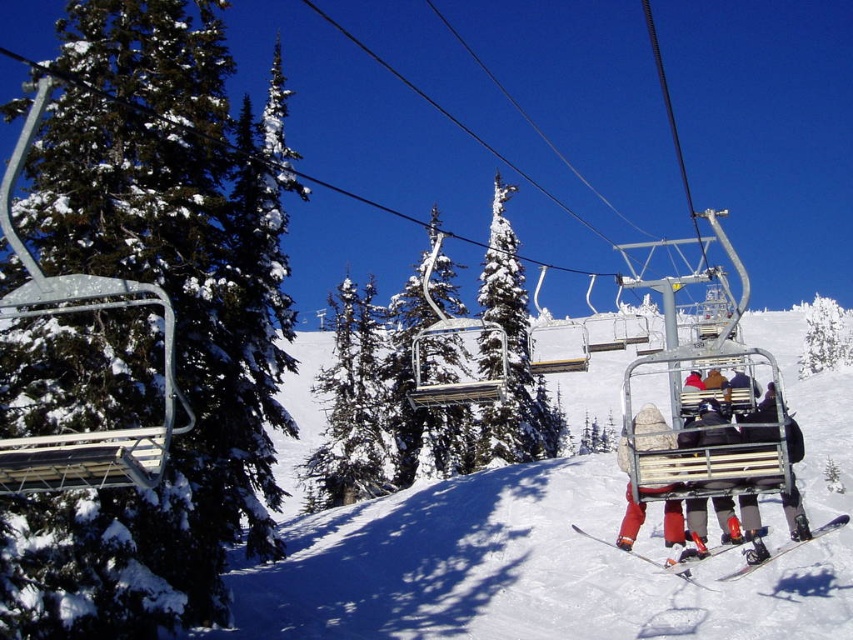
You are a photographer standing at the lower right corner of the scene. You want to take a photo of the green matte tree at left while keeping the matte black ski boots at lower right in the frame. Can you position yourself so that the tree is above the boots in the photo?

Yes, since the green matte tree at left is already positioned above the matte black ski boots at lower right in the scene, you can take the photo from your current position at the lower right corner to include both elements with the tree above the boots.

You are a skier standing at the base of the mountain looking up. You see the chairlift system with metal frames and benches in the foreground and the snow covered evergreen trees in the middle ground. There is also a point marked at coordinates (793, 513) which corresponds to matte black ski boots at lower right. Which direction should you move to reach the matte black ski boots at lower right from your current position?

The matte black ski boots at lower right are located at the lower right of the image, so you should move towards the lower right direction to reach them.